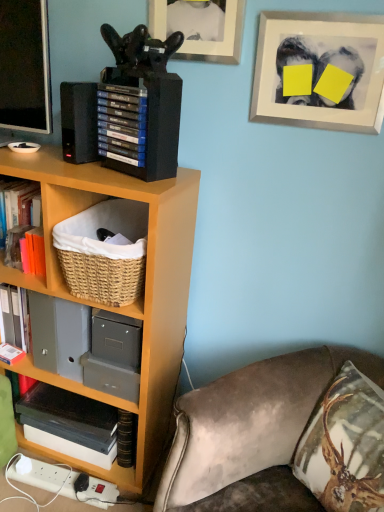
You are a GUI agent. You are given a task and a screenshot of the screen. Output one action in this format:
    pyautogui.click(x=<x>, y=<y>)
    Task: Click on the free space in front of black plastic speaker at upper left
    This screenshot has height=512, width=384.
    Given the screenshot: What is the action you would take?
    pyautogui.click(x=74, y=169)